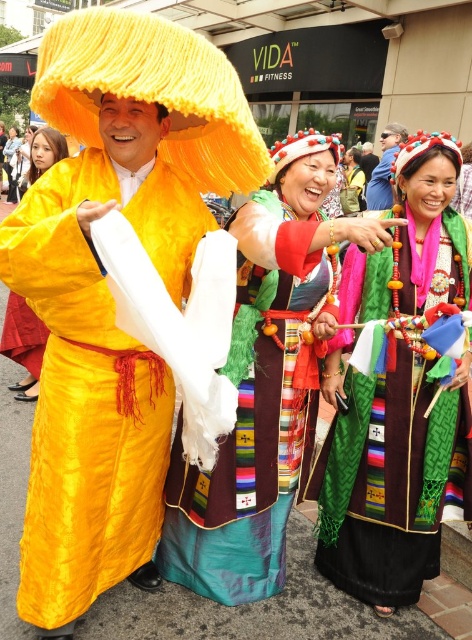
Question: Is textured green dress at center wider than silky green dress at center?

Choices:
 (A) yes
 (B) no

Answer: (B)

Question: Which object is closer to the camera taking this photo?

Choices:
 (A) shiny silk robe at left
 (B) matte yellow robe at center
 (C) matte black sunglasses at upper center
 (D) silky green dress at center

Answer: (A)

Question: Which object is the farthest from the matte black sunglasses at upper center?

Choices:
 (A) silky green dress at center
 (B) matte yellow robe at center
 (C) textured green dress at center
 (D) shiny silk robe at left

Answer: (D)

Question: Considering the real-world distances, which object is closest to the matte yellow robe at center?

Choices:
 (A) textured green dress at center
 (B) matte black sunglasses at upper center
 (C) silky green dress at center
 (D) shiny silk robe at left

Answer: (D)

Question: From the image, what is the correct spatial relationship of textured green dress at center in relation to matte black sunglasses at upper center?

Choices:
 (A) right
 (B) left

Answer: (B)

Question: Does textured green dress at center have a smaller size compared to matte black sunglasses at upper center?

Choices:
 (A) yes
 (B) no

Answer: (B)